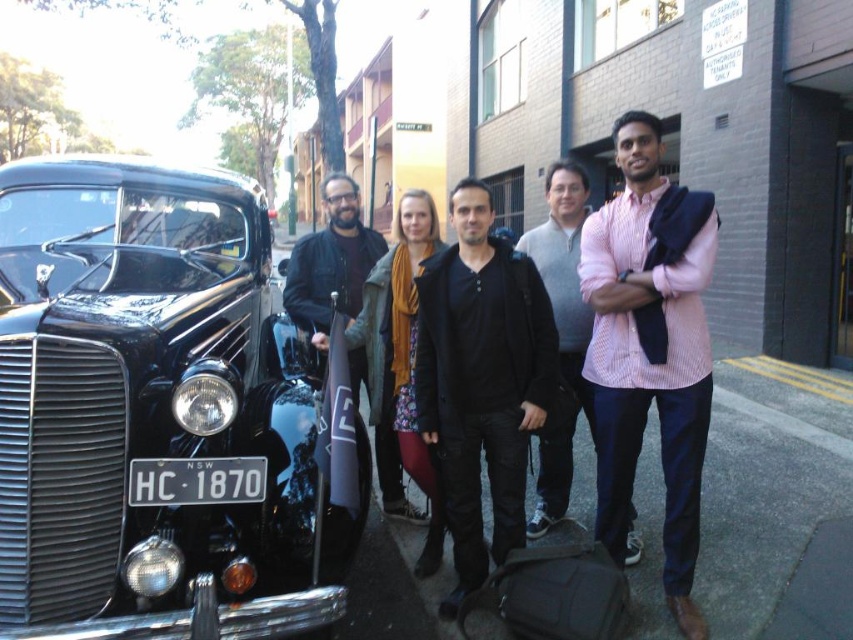
Question: Does pink striped shirt at center appear under dark brown leather jacket at center?

Choices:
 (A) yes
 (B) no

Answer: (A)

Question: Can you confirm if shiny black car at left is thinner than dark brown leather jacket at center?

Choices:
 (A) yes
 (B) no

Answer: (A)

Question: Among these objects, which one is nearest to the camera?

Choices:
 (A) matte black jacket at center
 (B) pink textured shirt at center

Answer: (A)

Question: Based on their relative distances, which object is nearer to the dark brown leather jacket at center?

Choices:
 (A) pink textured shirt at center
 (B) shiny black car at left
 (C) black metal license plate at lower left

Answer: (B)

Question: Estimate the real-world distances between objects in this image. Which object is closer to the pink striped shirt at center?

Choices:
 (A) pink textured shirt at center
 (B) shiny black car at left
 (C) dark brown leather jacket at center

Answer: (A)

Question: Does pink striped shirt at center appear on the left side of black matte jacket at center?

Choices:
 (A) no
 (B) yes

Answer: (A)